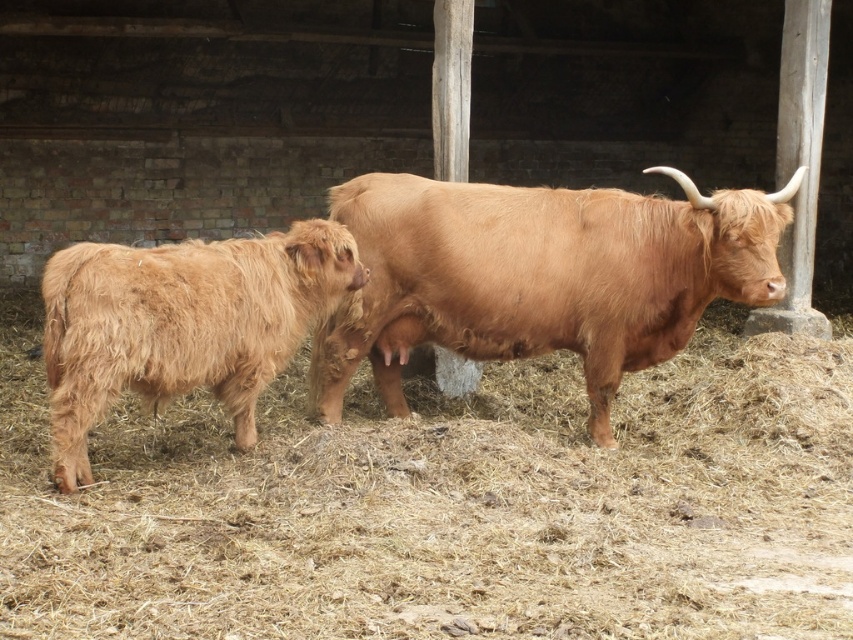
Question: Is brown woolly bull at center smaller than fuzzy brown yak at left?

Choices:
 (A) yes
 (B) no

Answer: (B)

Question: Where is brown woolly bull at center located in relation to fuzzy brown yak at left in the image?

Choices:
 (A) below
 (B) above

Answer: (B)

Question: Does brown woolly bull at center appear under fuzzy brown yak at left?

Choices:
 (A) no
 (B) yes

Answer: (A)

Question: Which object is closer to the camera taking this photo?

Choices:
 (A) brown woolly bull at center
 (B) fuzzy brown yak at left

Answer: (B)

Question: Which point is closer to the camera?

Choices:
 (A) (x=364, y=275)
 (B) (x=610, y=346)

Answer: (A)